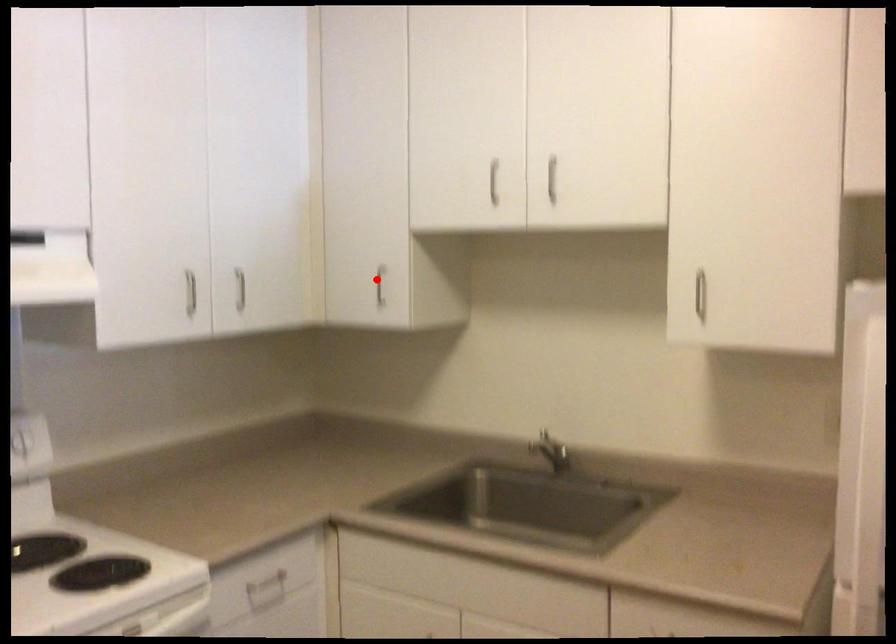
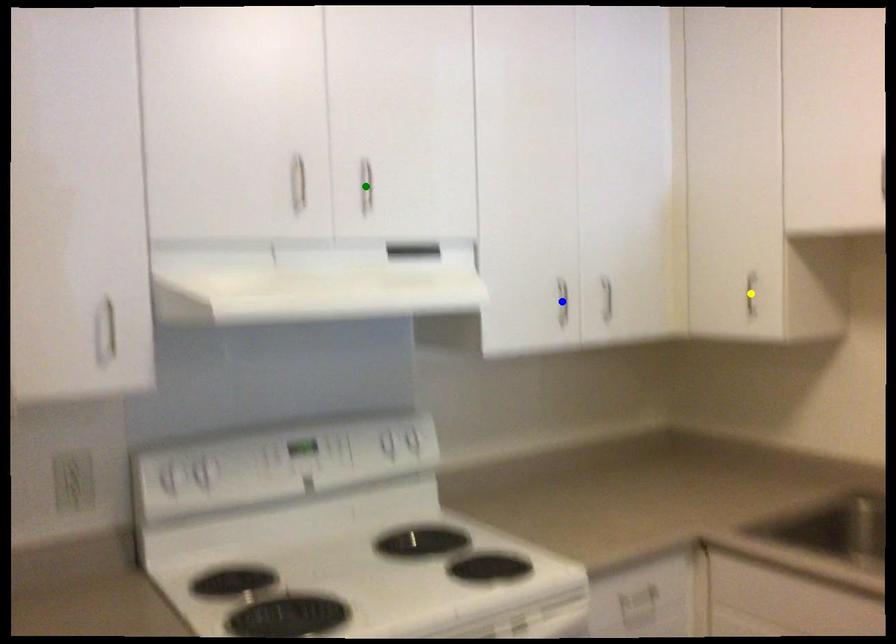
Question: I am providing you with two images of the same scene from different viewpoints. A red point is marked on the first image. You are given multiple points on the second image. Which point in image 2 is actually the same real-world point as the red point in image 1?

Choices:
 (A) yellow point
 (B) blue point
 (C) green point

Answer: (A)